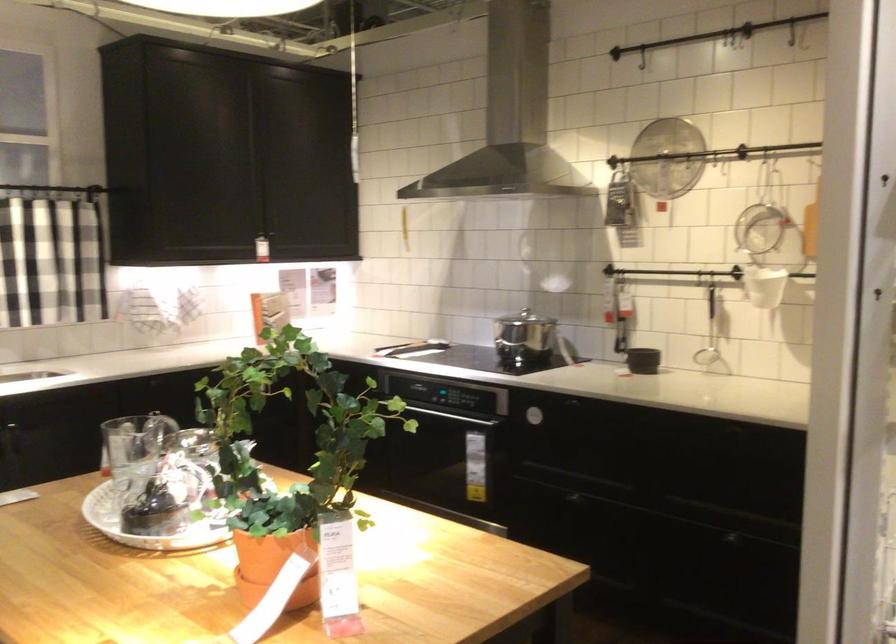
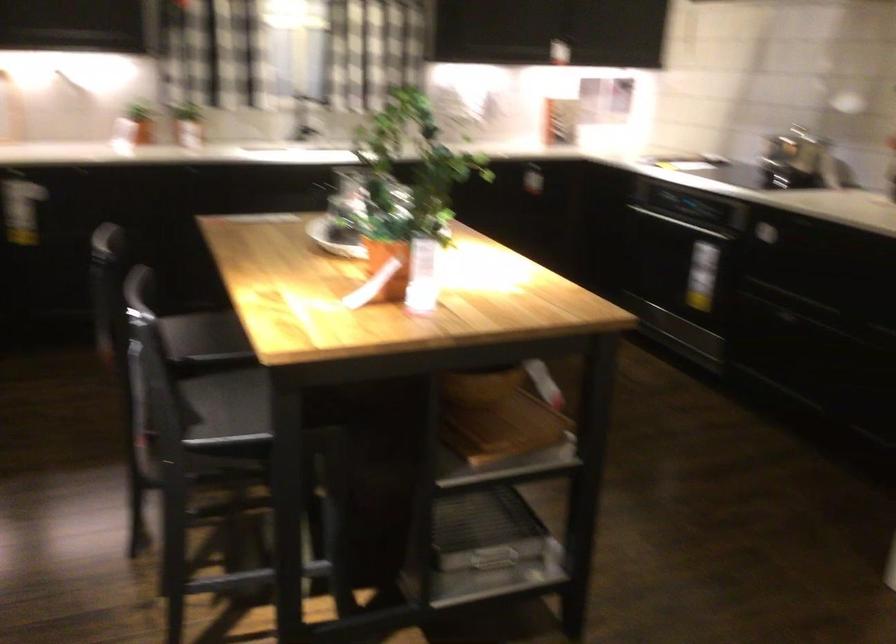
Where in the second image is the point corresponding to (x=350, y=571) from the first image?

(424, 275)